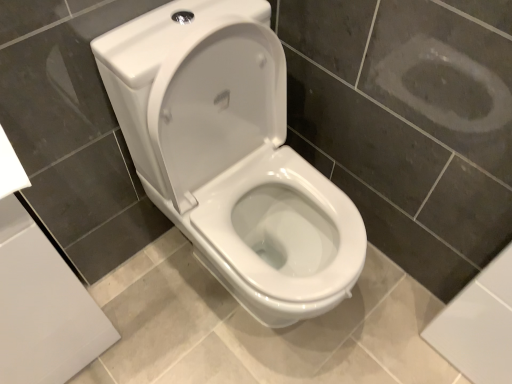
Find the location of a particular element. Image resolution: width=512 pixels, height=384 pixels. white glossy toilet at center is located at coordinates (231, 155).

In order to face white glossy toilet at center, should I rotate leftwards or rightwards?

A 0.799 degree turn to the right will do.

The image size is (512, 384). What do you see at coordinates (231, 155) in the screenshot? I see `white glossy toilet at center` at bounding box center [231, 155].

What are the coordinates of `white glossy toilet at center` in the screenshot? It's located at (231, 155).